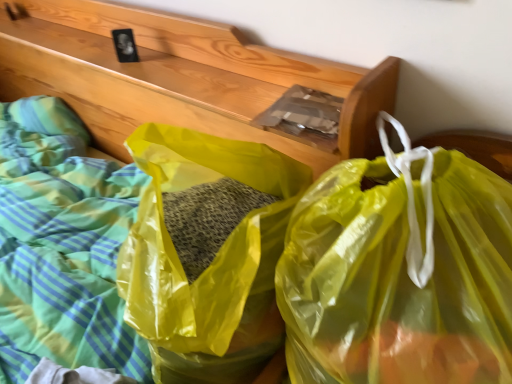
Question: Looking at the image, does translucent yellow plastic bag at center, which is the second plastic bag from left to right, seem bigger or smaller compared to yellow translucent plastic bag at center, the 2th plastic bag from the right?

Choices:
 (A) small
 (B) big

Answer: (A)

Question: Is translucent yellow plastic bag at center, which is the second plastic bag from left to right, situated inside yellow translucent plastic bag at center, the 2th plastic bag from the right, or outside?

Choices:
 (A) inside
 (B) outside

Answer: (B)

Question: From the image's perspective, is translucent yellow plastic bag at center, marked as the first plastic bag in a right-to-left arrangement, located above or below yellow translucent plastic bag at center, the 2th plastic bag from the right?

Choices:
 (A) below
 (B) above

Answer: (A)

Question: Considering the positions of point (138, 221) and point (381, 347), is point (138, 221) closer or farther from the camera than point (381, 347)?

Choices:
 (A) farther
 (B) closer

Answer: (A)

Question: Is yellow translucent plastic bag at center, acting as the first plastic bag starting from the left, in front of or behind translucent yellow plastic bag at center, which is the second plastic bag from left to right, in the image?

Choices:
 (A) front
 (B) behind

Answer: (B)

Question: Is yellow translucent plastic bag at center, acting as the first plastic bag starting from the left, situated inside translucent yellow plastic bag at center, which is the second plastic bag from left to right, or outside?

Choices:
 (A) outside
 (B) inside

Answer: (A)

Question: Considering the positions of yellow translucent plastic bag at center, acting as the first plastic bag starting from the left, and translucent yellow plastic bag at center, marked as the first plastic bag in a right-to-left arrangement, in the image, is yellow translucent plastic bag at center, acting as the first plastic bag starting from the left, taller or shorter than translucent yellow plastic bag at center, marked as the first plastic bag in a right-to-left arrangement,?

Choices:
 (A) short
 (B) tall

Answer: (A)